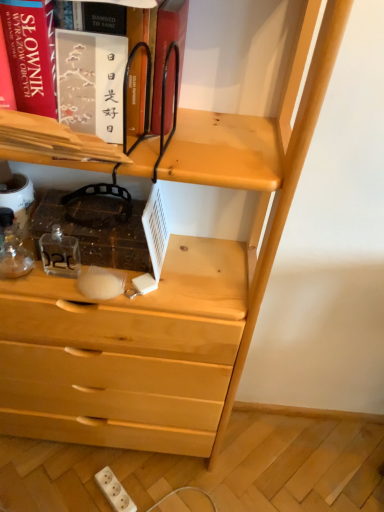
Locate an element on the screen. This screenshot has width=384, height=512. white plastic electric outlet at lower center is located at coordinates (114, 490).

Describe the element at coordinates (114, 490) in the screenshot. The image size is (384, 512). I see `white plastic electric outlet at lower center` at that location.

Find the location of a particular element. matte black book at upper left is located at coordinates (34, 57).

Measure the distance between point (169,84) and camera.

They are 25.28 inches apart.

The height and width of the screenshot is (512, 384). Describe the element at coordinates (34, 57) in the screenshot. I see `matte black book at upper left` at that location.

This screenshot has height=512, width=384. I want to click on white plastic electric outlet at lower center, so click(114, 490).

Is matte black book at upper left at the right side of white plastic electric outlet at lower center?

Yes.

Considering the positions of objects matte black book at upper left and white plastic electric outlet at lower center in the image provided, who is behind, matte black book at upper left or white plastic electric outlet at lower center?

white plastic electric outlet at lower center is further from the camera.

Does point (114, 92) come in front of point (118, 483)?

That is True.

From the image's perspective, is matte black book at upper left above or below white plastic electric outlet at lower center?

Clearly, from the image's perspective, matte black book at upper left is above white plastic electric outlet at lower center.

Looking at this image, from a real-world perspective, is matte black book at upper left located higher than white plastic electric outlet at lower center?

Yes, from a real-world perspective, matte black book at upper left is above white plastic electric outlet at lower center.

Does matte black book at upper left have a lesser width compared to white plastic electric outlet at lower center?

No, matte black book at upper left is not thinner than white plastic electric outlet at lower center.

Does matte black book at upper left have a lesser height compared to white plastic electric outlet at lower center?

No, matte black book at upper left is not shorter than white plastic electric outlet at lower center.

Considering the relative sizes of matte black book at upper left and white plastic electric outlet at lower center in the image provided, is matte black book at upper left bigger than white plastic electric outlet at lower center?

Yes.

Is white plastic electric outlet at lower center inside matte black book at upper left?

Actually, white plastic electric outlet at lower center is outside matte black book at upper left.

Is matte black book at upper left far from white plastic electric outlet at lower center?

Yes, matte black book at upper left and white plastic electric outlet at lower center are quite far apart.

Is matte black book at upper left oriented away from white plastic electric outlet at lower center?

matte black book at upper left does not have its back to white plastic electric outlet at lower center.

How different are the orientations of matte black book at upper left and white plastic electric outlet at lower center in degrees?

44.8 degrees separate the facing orientations of matte black book at upper left and white plastic electric outlet at lower center.

Could you measure the distance between matte black book at upper left and white plastic electric outlet at lower center?

matte black book at upper left and white plastic electric outlet at lower center are 3.65 feet apart from each other.

This screenshot has height=512, width=384. In order to click on book on the right of white plastic electric outlet at lower center in this screenshot , I will do [x=34, y=57].

Which is more to the left, white plastic electric outlet at lower center or matte black book at upper left?

From the viewer's perspective, white plastic electric outlet at lower center appears more on the left side.

Is the depth of white plastic electric outlet at lower center less than that of matte black book at upper left?

No, white plastic electric outlet at lower center is further to the viewer.

Between point (127, 495) and point (167, 124), which one is positioned in front?

Positioned in front is point (167, 124).

Based on the photo, from the image's perspective, which one is positioned lower, white plastic electric outlet at lower center or matte black book at upper left?

white plastic electric outlet at lower center, from the image's perspective.

From a real-world perspective, is white plastic electric outlet at lower center positioned above or below matte black book at upper left?

white plastic electric outlet at lower center is situated lower than matte black book at upper left in the real world.

Between white plastic electric outlet at lower center and matte black book at upper left, which one has larger width?

matte black book at upper left.

Which of these two, white plastic electric outlet at lower center or matte black book at upper left, stands shorter?

With less height is white plastic electric outlet at lower center.

Is white plastic electric outlet at lower center bigger or smaller than matte black book at upper left?

Considering their sizes, white plastic electric outlet at lower center takes up less space than matte black book at upper left.

Is white plastic electric outlet at lower center outside of matte black book at upper left?

Yes, white plastic electric outlet at lower center is not within matte black book at upper left.

Are white plastic electric outlet at lower center and matte black book at upper left located far from each other?

Yes.

Is white plastic electric outlet at lower center turned away from matte black book at upper left?

No, white plastic electric outlet at lower center's orientation is not away from matte black book at upper left.

How many degrees apart are the facing directions of white plastic electric outlet at lower center and matte black book at upper left?

The facing directions of white plastic electric outlet at lower center and matte black book at upper left are 44.8 degrees apart.

How much distance is there between white plastic electric outlet at lower center and matte black book at upper left?

The distance of white plastic electric outlet at lower center from matte black book at upper left is 1.11 meters.

Find the location of a particular element. electric outlet on the left of matte black book at upper left is located at coordinates (114, 490).

Identify the location of book above the white plastic electric outlet at lower center (from the image's perspective). (34, 57).

Locate an element on the screen. Image resolution: width=384 pixels, height=512 pixels. book above the white plastic electric outlet at lower center (from a real-world perspective) is located at coordinates (34, 57).